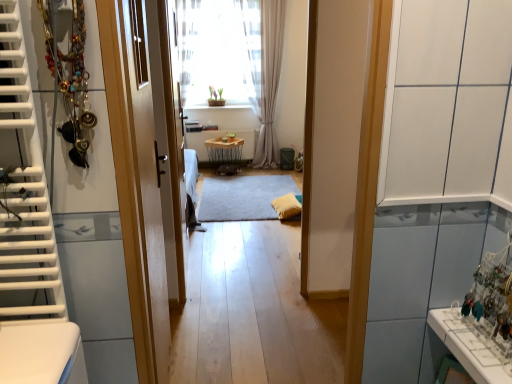
Question: Would you say white glossy radiator at center is to the left or to the right of wooden table at center in the picture?

Choices:
 (A) right
 (B) left

Answer: (B)

Question: From the image's perspective, relative to wooden table at center, is white glossy radiator at center above or below?

Choices:
 (A) below
 (B) above

Answer: (B)

Question: Based on their relative distances, which object is farther from the white sheer curtain at upper center, which ranks as the 1th curtain in left-to-right order?

Choices:
 (A) shiny metallic necklace at left
 (B) gray soft rug at center
 (C) wooden table at center
 (D) wooden door at center
 (E) white glossy radiator at center

Answer: (A)

Question: Which is nearer to the wooden door at center?

Choices:
 (A) light beige sheer curtain at center, the second curtain from the left
 (B) white sheer curtain at upper center, which ranks as the 2th curtain in right-to-left order
 (C) white glossy radiator at center
 (D) shiny metallic necklace at left
 (E) gray soft rug at center

Answer: (D)